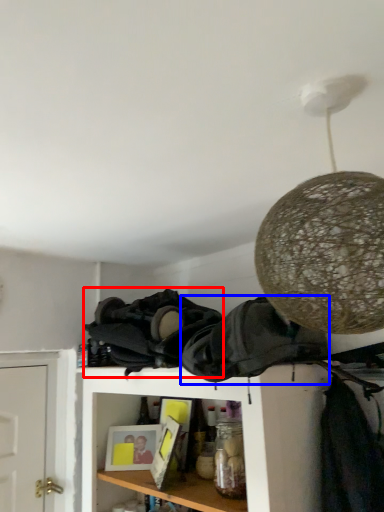
Question: Which point is closer to the camera, clothing (highlighted by a red box) or clothing (highlighted by a blue box)?

Choices:
 (A) clothing
 (B) clothing

Answer: (B)